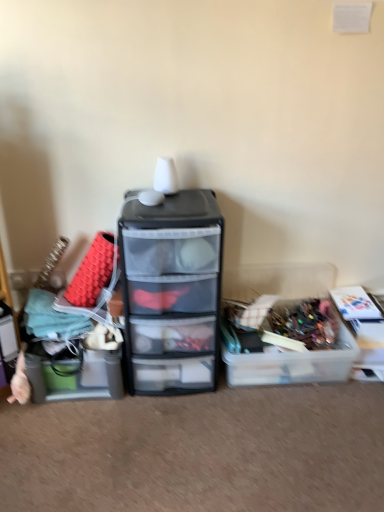
This screenshot has height=512, width=384. Identify the location of free location in front of translucent plastic storage box at left, which appears as the 3th storage box when viewed from the right. (73, 434).